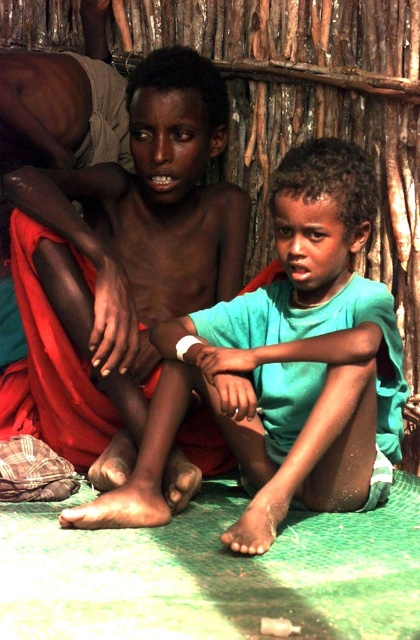
Is green matte shirt at center above matte skin boy at center?

Actually, green matte shirt at center is below matte skin boy at center.

Does green matte shirt at center have a lesser width compared to matte skin boy at center?

No, green matte shirt at center is not thinner than matte skin boy at center.

The image size is (420, 640). Identify the location of green matte shirt at center. (286, 365).